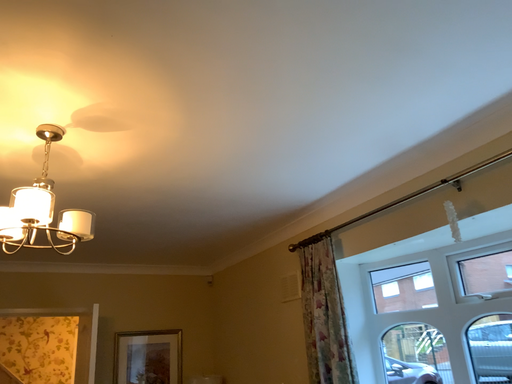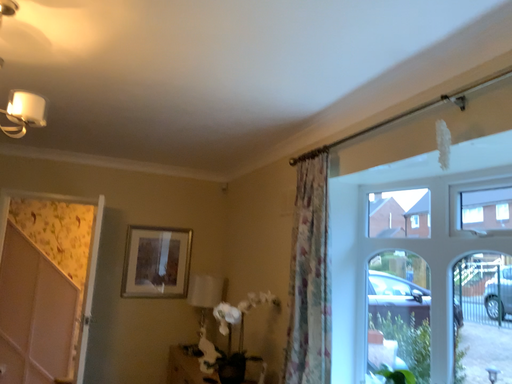
Question: Which way did the camera rotate in the video?

Choices:
 (A) rotated downward
 (B) rotated upward

Answer: (A)